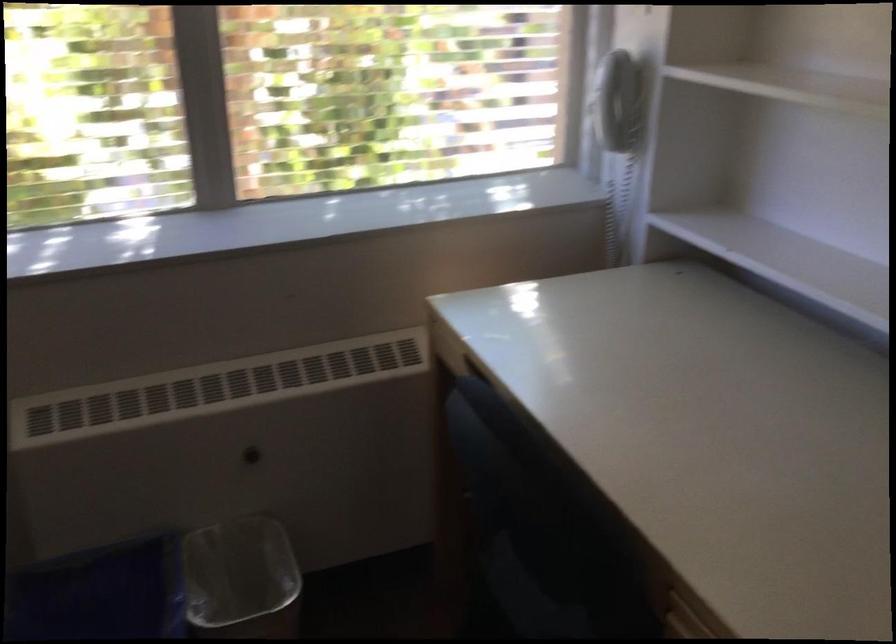
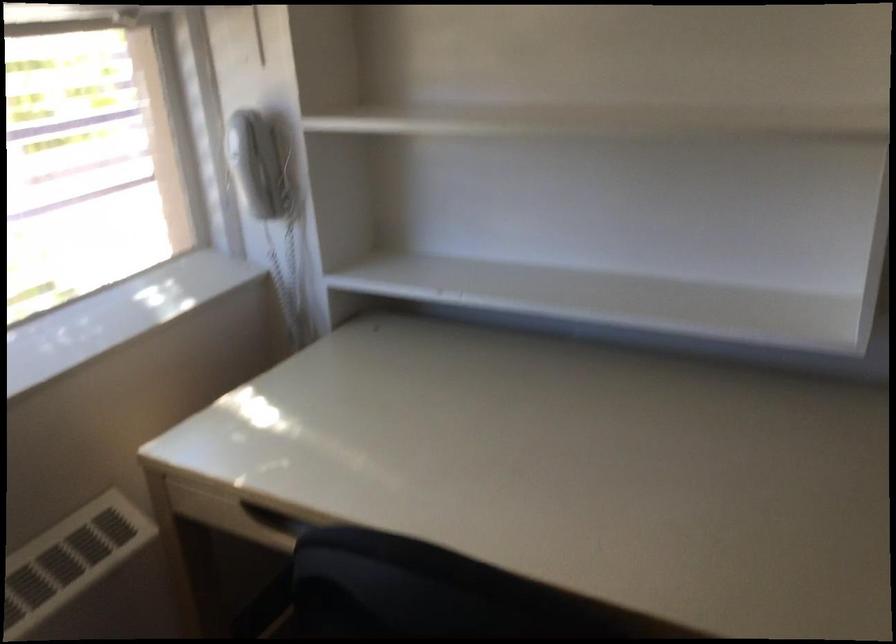
Find the pixel in the second image that matches pixel 615 95 in the first image.

(261, 165)